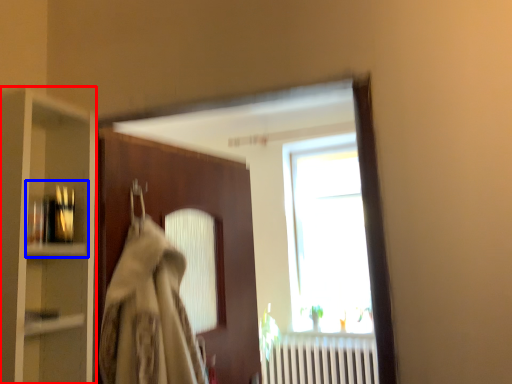
Question: Which object appears farthest to the camera in this image, cabinetry (highlighted by a red box) or shelf (highlighted by a blue box)?

Choices:
 (A) cabinetry
 (B) shelf

Answer: (B)